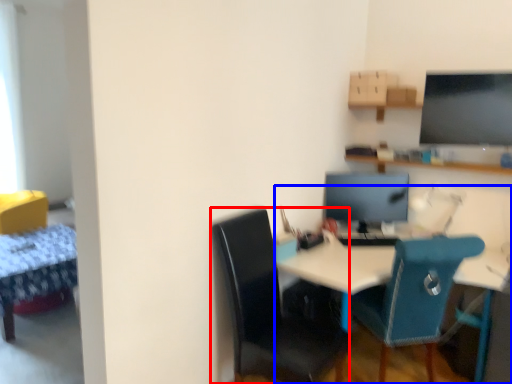
Question: Which object is further to the camera taking this photo, chair (highlighted by a red box) or desk (highlighted by a blue box)?

Choices:
 (A) chair
 (B) desk

Answer: (B)